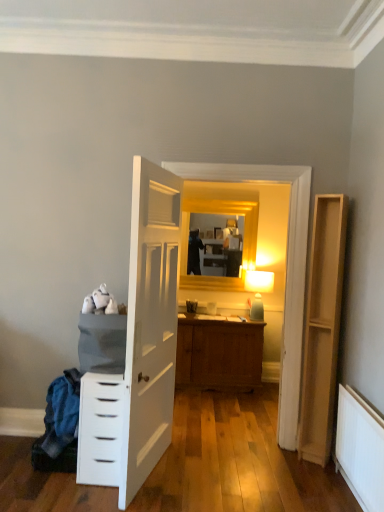
Where is `space that is in front of light brown wood file cabinet at right`? The width and height of the screenshot is (384, 512). space that is in front of light brown wood file cabinet at right is located at coordinates (316, 472).